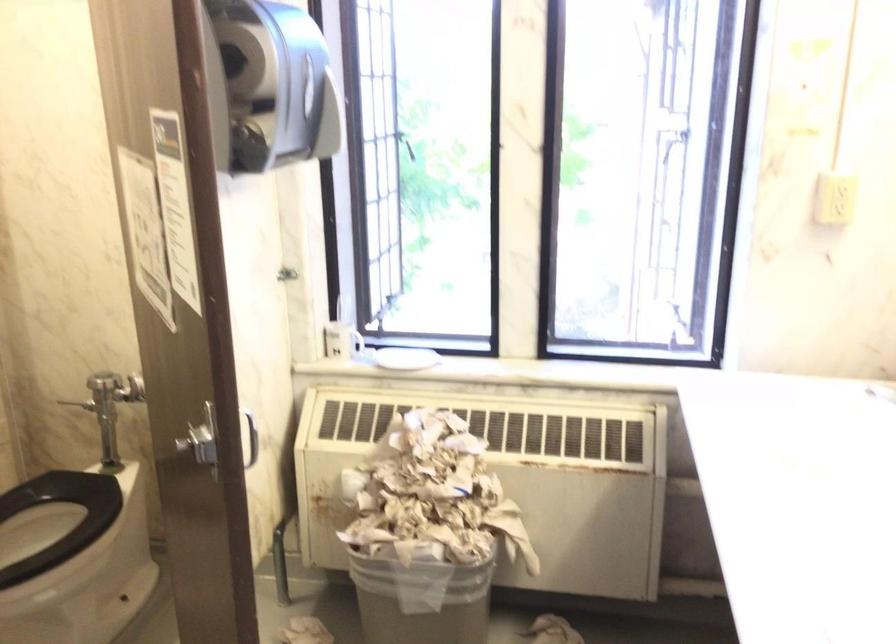
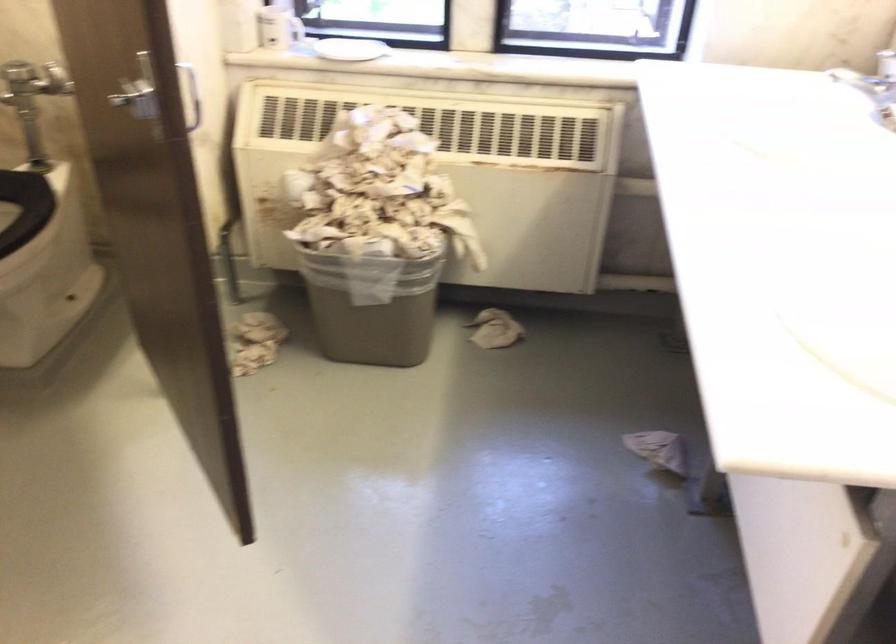
Where in the second image is the point corresponding to point (341, 341) from the first image?

(279, 26)